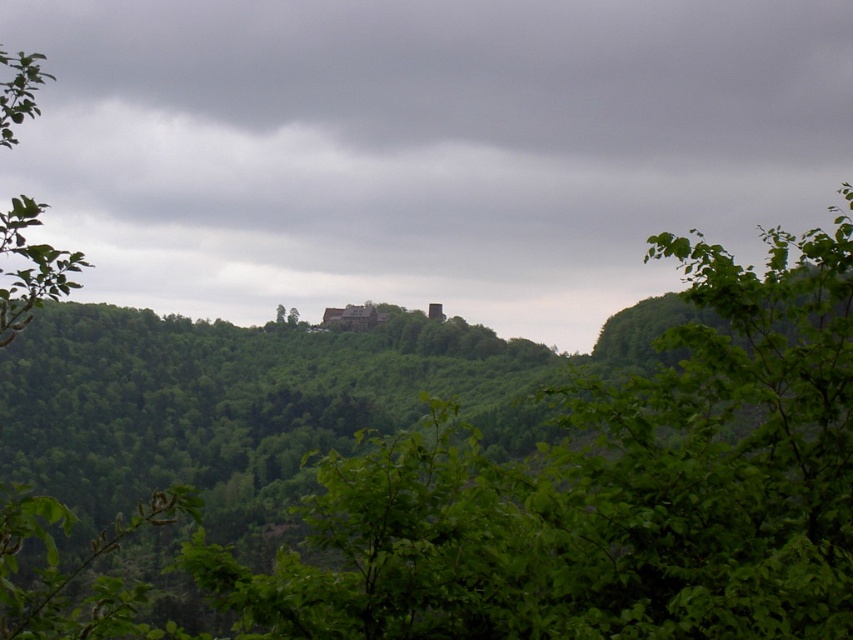
Question: Considering the relative positions of green leafy tree at center and green leafy tree at left in the image provided, where is green leafy tree at center located with respect to green leafy tree at left?

Choices:
 (A) right
 (B) left

Answer: (A)

Question: Which of the following is the closest to the observer?

Choices:
 (A) green leafy tree at left
 (B) green leafy tree at center

Answer: (B)

Question: Can you confirm if green leafy tree at center is thinner than green leafy tree at left?

Choices:
 (A) no
 (B) yes

Answer: (B)

Question: Is green leafy tree at center smaller than green leafy tree at left?

Choices:
 (A) no
 (B) yes

Answer: (B)

Question: Which of the following is the farthest from the observer?

Choices:
 (A) green leafy tree at left
 (B) green leafy tree at center

Answer: (A)